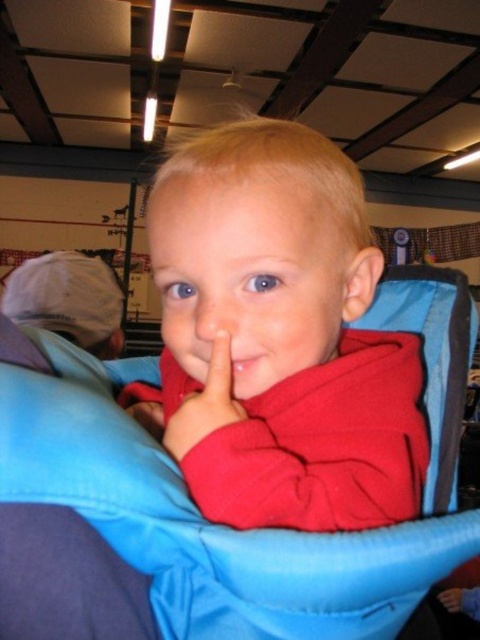
Question: Is blue fabric baby carriage at center behind matte red finger at center?

Choices:
 (A) no
 (B) yes

Answer: (A)

Question: Is the position of blue fabric baby carriage at center less distant than that of matte red finger at center?

Choices:
 (A) no
 (B) yes

Answer: (B)

Question: In this image, where is white matte cap at upper left located relative to matte red finger at center?

Choices:
 (A) above
 (B) below

Answer: (A)

Question: Which point is farther to the camera?

Choices:
 (A) white matte cap at upper left
 (B) matte red finger at center

Answer: (A)

Question: Estimate the real-world distances between objects in this image. Which object is closer to the red fleece at center?

Choices:
 (A) blue fabric baby carriage at center
 (B) white matte cap at upper left

Answer: (A)

Question: Estimate the real-world distances between objects in this image. Which object is farther from the matte red finger at center?

Choices:
 (A) white matte cap at upper left
 (B) blue fabric baby carriage at center
 (C) red fleece at center

Answer: (A)